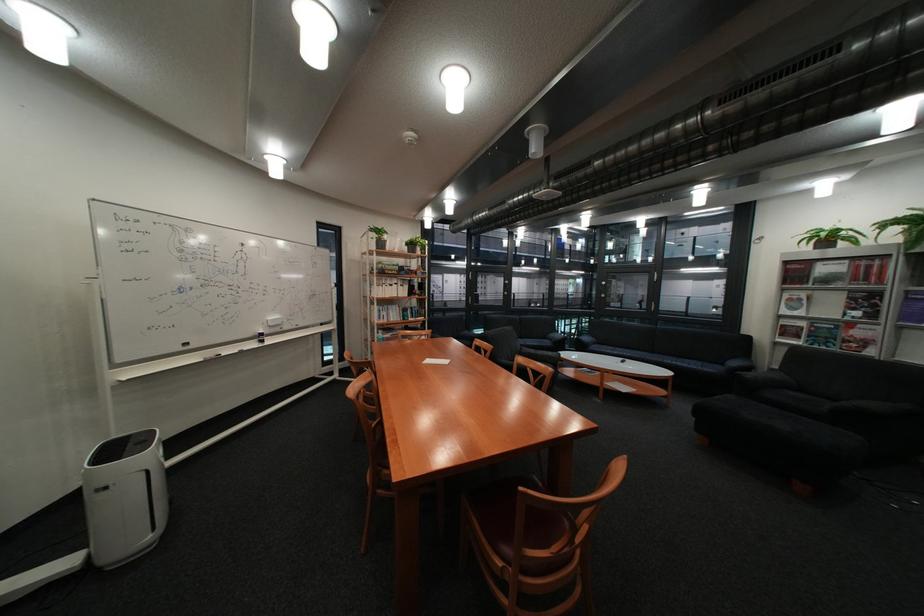
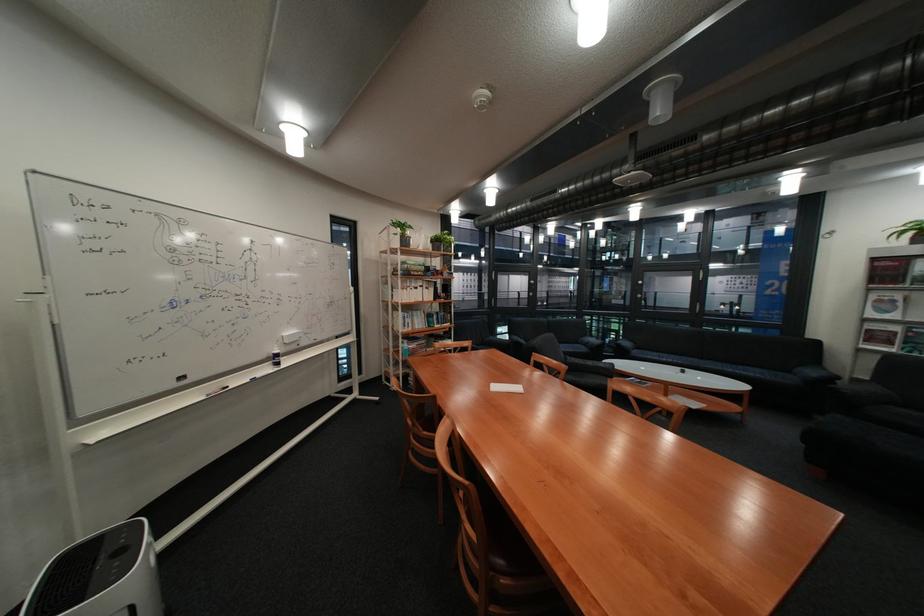
Question: The camera is either moving clockwise (left) or counter-clockwise (right) around the object. The first image is from the beginning of the video and the second image is from the end. Is the camera moving left or right when shooting the video?

Choices:
 (A) Left
 (B) Right

Answer: (A)